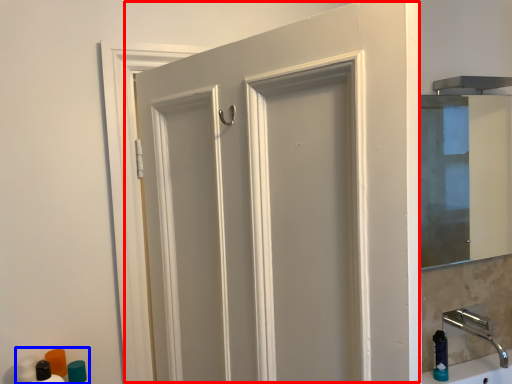
Question: Which of the following is the closest to the observer, door (highlighted by a red box) or toiletry (highlighted by a blue box)?

Choices:
 (A) door
 (B) toiletry

Answer: (A)